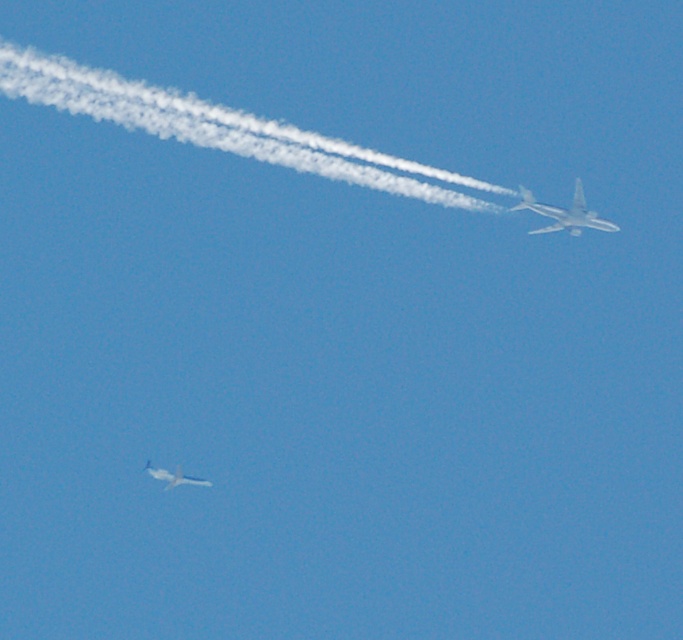
You are standing at the point where the two airplanes are flying in the clear blue sky. You want to know how far you are from the point marked at coordinates point (596, 218). Can you determine the distance?

The distance between you and the point (596, 218) is 178.80 meters.

You are a pilot observing two planes in the sky. You see the white vapor trail at upper center and the white glossy airplane at upper right. Which object is positioned higher in the sky?

The white vapor trail at upper center is located above the white glossy airplane at upper right, meaning the white vapor trail at upper center is higher in the sky.